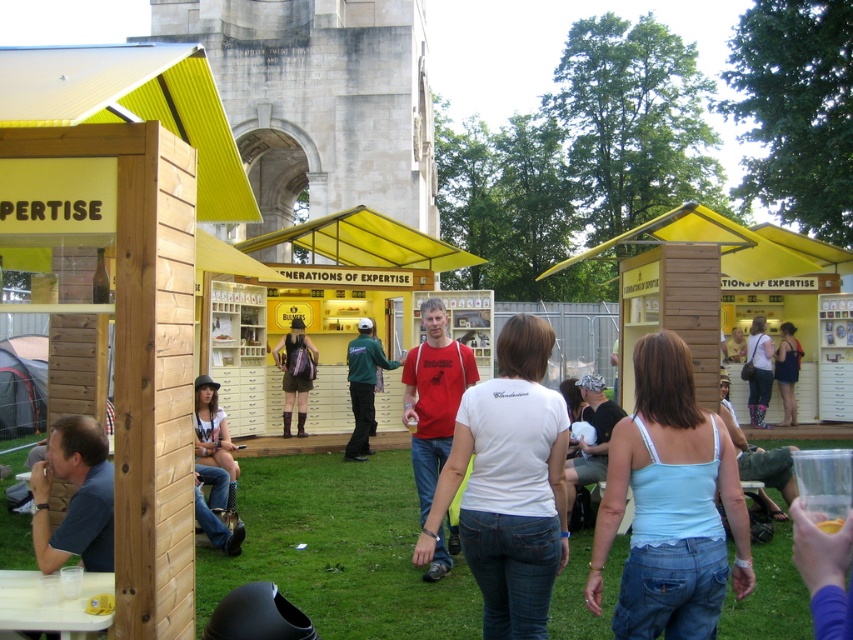
Which is below, green grass at lower center or blue shirt at lower left?

green grass at lower center is lower down.

Which is in front, point (289, 540) or point (74, 460)?

Point (74, 460) is more forward.

The width and height of the screenshot is (853, 640). I want to click on green grass at lower center, so click(x=339, y=548).

The image size is (853, 640). Identify the location of red matte t-shirt at center. (433, 397).

Consider the image. Is red matte t-shirt at center smaller than green fabric jacket at center?

No.

I want to click on red matte t-shirt at center, so click(433, 397).

Measure the distance between white cotton t-shirt at center and camera.

The distance of white cotton t-shirt at center from camera is 17.29 meters.

Is point (512, 588) farther from viewer compared to point (433, 326)?

No, (512, 588) is in front of (433, 326).

Which is behind, point (503, 557) or point (457, 362)?

The point (457, 362) is more distant.

I want to click on white cotton t-shirt at center, so click(509, 484).